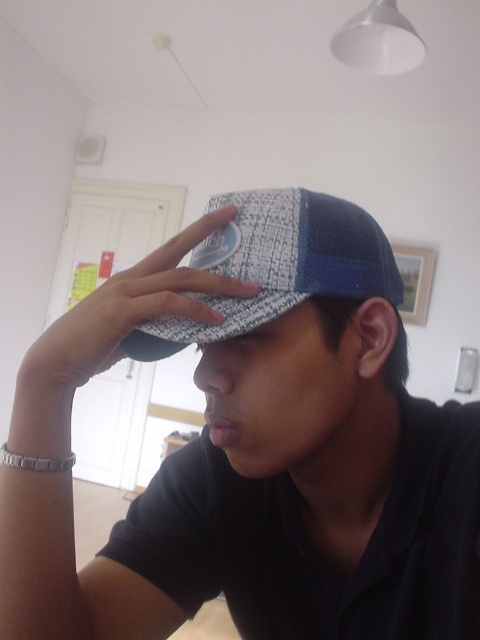
Is point (162, 305) positioned after point (216, 234)?

No, (162, 305) is in front of (216, 234).

Who is higher up, woven fabric cap at center or blue mesh cap at center?

Positioned higher is blue mesh cap at center.

You are a GUI agent. You are given a task and a screenshot of the screen. Output one action in this format:
    pyautogui.click(x=<x>, y=<y>)
    Task: Click on the woven fabric cap at center
    Image resolution: width=480 pixels, height=640 pixels.
    Given the screenshot: What is the action you would take?
    pyautogui.click(x=253, y=448)

What do you see at coordinates (253, 448) in the screenshot? The image size is (480, 640). I see `woven fabric cap at center` at bounding box center [253, 448].

Who is positioned more to the left, woven fabric cap at center or white textured cap at center?

From the viewer's perspective, white textured cap at center appears more on the left side.

Where is `woven fabric cap at center`? woven fabric cap at center is located at coordinates (253, 448).

What do you see at coordinates (277, 264) in the screenshot? The height and width of the screenshot is (640, 480). I see `blue mesh cap at center` at bounding box center [277, 264].

Between blue mesh cap at center and white textured cap at center, which one appears on the left side from the viewer's perspective?

From the viewer's perspective, white textured cap at center appears more on the left side.

The image size is (480, 640). Find the location of `blue mesh cap at center`. blue mesh cap at center is located at coordinates (277, 264).

The image size is (480, 640). Find the location of `blue mesh cap at center`. blue mesh cap at center is located at coordinates (277, 264).